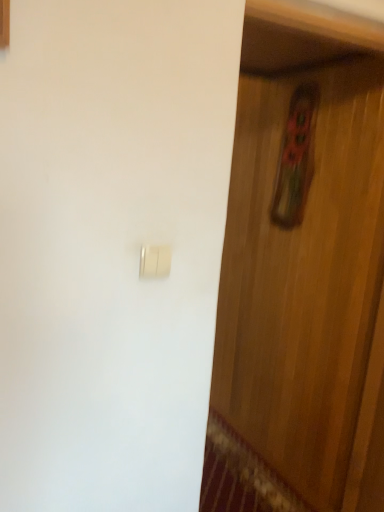
Image resolution: width=384 pixels, height=512 pixels. Describe the element at coordinates (155, 261) in the screenshot. I see `gold metallic light switch at center` at that location.

Identify the location of gold metallic light switch at center. The height and width of the screenshot is (512, 384). (155, 261).

The width and height of the screenshot is (384, 512). Describe the element at coordinates (302, 269) in the screenshot. I see `wooden door at center` at that location.

Where is `wooden door at center`? The image size is (384, 512). wooden door at center is located at coordinates (302, 269).

Find the location of a particular element. Image resolution: width=384 pixels, height=512 pixels. gold metallic light switch at center is located at coordinates (155, 261).

Is gold metallic light switch at center to the right of wooden door at center from the viewer's perspective?

Incorrect, gold metallic light switch at center is not on the right side of wooden door at center.

Does gold metallic light switch at center lie behind wooden door at center?

No, it is in front of wooden door at center.

Is point (140, 259) closer to camera compared to point (346, 159)?

Yes.

From the image's perspective, relative to wooden door at center, is gold metallic light switch at center above or below?

Clearly, from the image's perspective, gold metallic light switch at center is above wooden door at center.

From a real-world perspective, is gold metallic light switch at center under wooden door at center?

Actually, gold metallic light switch at center is physically above wooden door at center in the real world.

Based on the photo, between gold metallic light switch at center and wooden door at center, which one has larger width?

With larger width is wooden door at center.

Which of these two, gold metallic light switch at center or wooden door at center, stands shorter?

gold metallic light switch at center is shorter.

Who is smaller, gold metallic light switch at center or wooden door at center?

With smaller size is gold metallic light switch at center.

Can wooden door at center be found inside gold metallic light switch at center?

No, wooden door at center is not a part of gold metallic light switch at center.

Would you consider gold metallic light switch at center to be distant from wooden door at center?

Yes, gold metallic light switch at center is far from wooden door at center.

Is gold metallic light switch at center looking in the opposite direction of wooden door at center?

No, gold metallic light switch at center is not facing away from wooden door at center.

How different are the orientations of gold metallic light switch at center and wooden door at center in degrees?

0.406 degrees separate the facing orientations of gold metallic light switch at center and wooden door at center.

This screenshot has width=384, height=512. Find the location of `door located behind the gold metallic light switch at center`. door located behind the gold metallic light switch at center is located at coordinates (x=302, y=269).

Considering the relative positions of wooden door at center and gold metallic light switch at center in the image provided, is wooden door at center to the left or to the right of gold metallic light switch at center?

Based on their positions, wooden door at center is located to the right of gold metallic light switch at center.

Which object is more forward, wooden door at center or gold metallic light switch at center?

gold metallic light switch at center is closer to the camera.

Is point (322, 111) closer or farther from the camera than point (166, 271)?

Point (322, 111) appears to be farther away from the viewer than point (166, 271).

From the image's perspective, does wooden door at center appear higher than gold metallic light switch at center?

No, from the image's perspective, wooden door at center is not on top of gold metallic light switch at center.

Looking at this image, from a real-world perspective, does wooden door at center stand above gold metallic light switch at center?

No.

Does wooden door at center have a greater width compared to gold metallic light switch at center?

Yes.

Considering the sizes of objects wooden door at center and gold metallic light switch at center in the image provided, who is shorter, wooden door at center or gold metallic light switch at center?

Answer: With less height is gold metallic light switch at center.

Does wooden door at center have a smaller size compared to gold metallic light switch at center?

Actually, wooden door at center might be larger than gold metallic light switch at center.

Is wooden door at center outside of gold metallic light switch at center?

Absolutely, wooden door at center is external to gold metallic light switch at center.

Is wooden door at center far away from gold metallic light switch at center?

That's right, there is a large distance between wooden door at center and gold metallic light switch at center.

From the picture: Is wooden door at center looking in the opposite direction of gold metallic light switch at center?

No, wooden door at center is not facing away from gold metallic light switch at center.

Measure the distance between wooden door at center and gold metallic light switch at center.

wooden door at center and gold metallic light switch at center are 1.40 meters apart.

At what (x,y) coordinates should I click in order to perform the action: click on door lying behind the gold metallic light switch at center. Please return your answer as a coordinate pair (x, y). This screenshot has height=512, width=384. Looking at the image, I should click on (302, 269).

Find the location of a particular element. The width and height of the screenshot is (384, 512). door that appears on the right of gold metallic light switch at center is located at coordinates pyautogui.click(x=302, y=269).

I want to click on light switch that appears on the left of wooden door at center, so click(x=155, y=261).